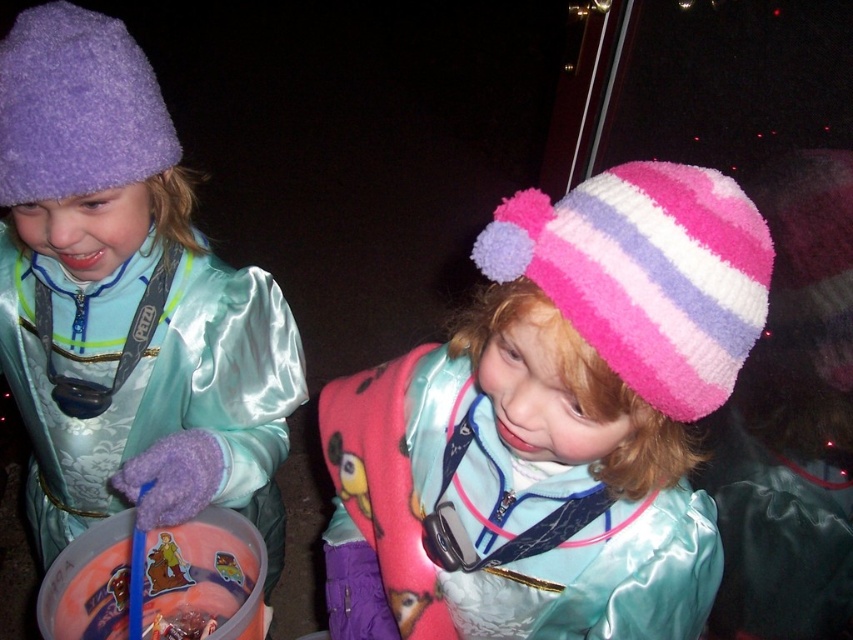
Which is in front, point (144, 301) or point (664, 193)?

Point (664, 193) is in front.

Does point (114, 260) lie behind point (712, 298)?

Yes, it is.

Where is `matte purple hat at left`? The height and width of the screenshot is (640, 853). matte purple hat at left is located at coordinates (126, 301).

Is matte purple hat at left below purple fuzzy hat at upper left?

Yes.

Is matte purple hat at left to the left of purple fuzzy hat at upper left from the viewer's perspective?

Indeed, matte purple hat at left is positioned on the left side of purple fuzzy hat at upper left.

Measure the distance between point (42, 353) and camera.

They are 1.10 meters apart.

What are the coordinates of `matte purple hat at left` in the screenshot? It's located at (126, 301).

Between pink fuzzy hat at center and purple fuzzy hat at upper left, which one has less height?

With less height is purple fuzzy hat at upper left.

Is point (556, 586) farther from camera compared to point (111, 129)?

No.

Locate an element on the screen. pink fuzzy hat at center is located at coordinates pos(553,424).